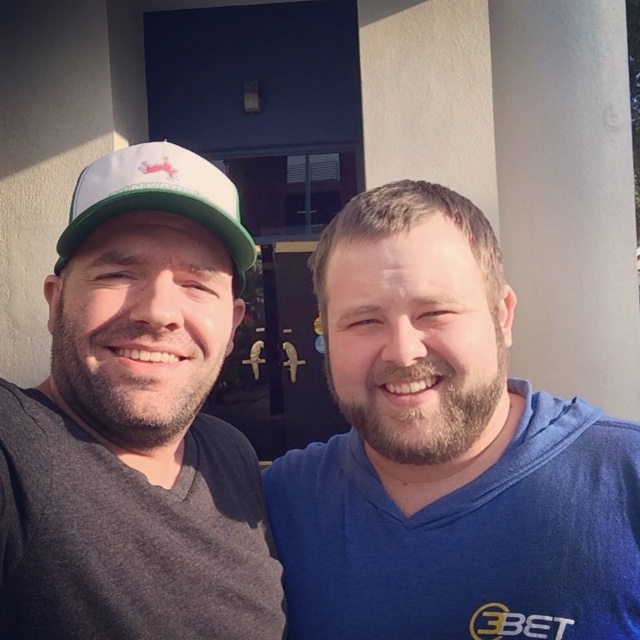
You are a photographer trying to focus on the gray matte cap at left. You notice a point at coordinates (x=136, y=422). Is this point located on the gray matte cap at left?

Yes, the point (x=136, y=422) is on the gray matte cap at left according to the description.

You are a photographer trying to capture a clear shot of both the blue cotton shirt at center and the white fabric baseball cap at left. Based on their positions, which object should you focus on first to ensure both are in the frame?

The blue cotton shirt at center is positioned under the white fabric baseball cap at left, so focusing on the white fabric baseball cap at left first will ensure both objects remain in the frame.

You are a photographer trying to capture the perfect selfie. You notice the blue cotton shirt at center and the gray matte cap at left. Which item should you focus on to ensure it takes up more space in the photo?

The blue cotton shirt at center has a greater height compared to the gray matte cap at left, so focusing on it will ensure it takes up more space in the photo.